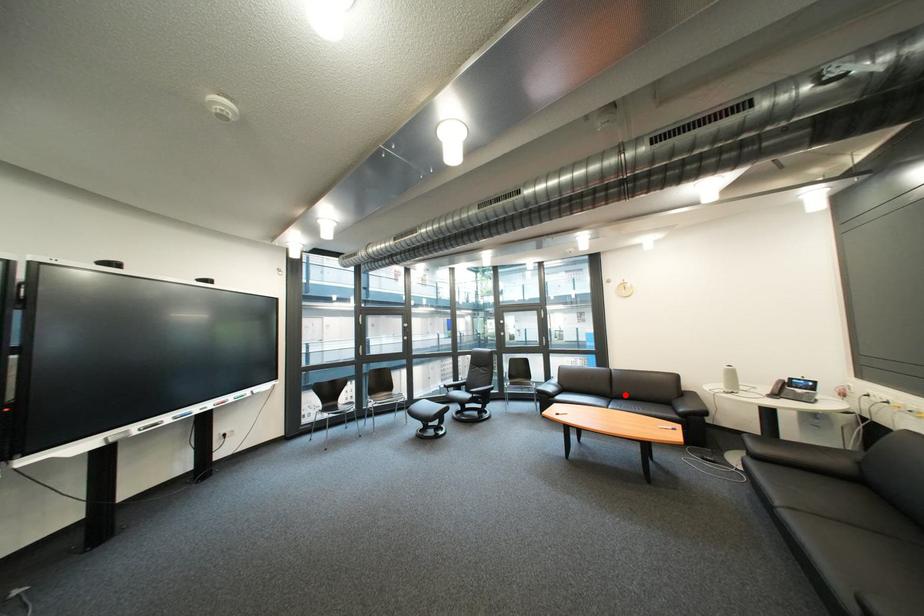
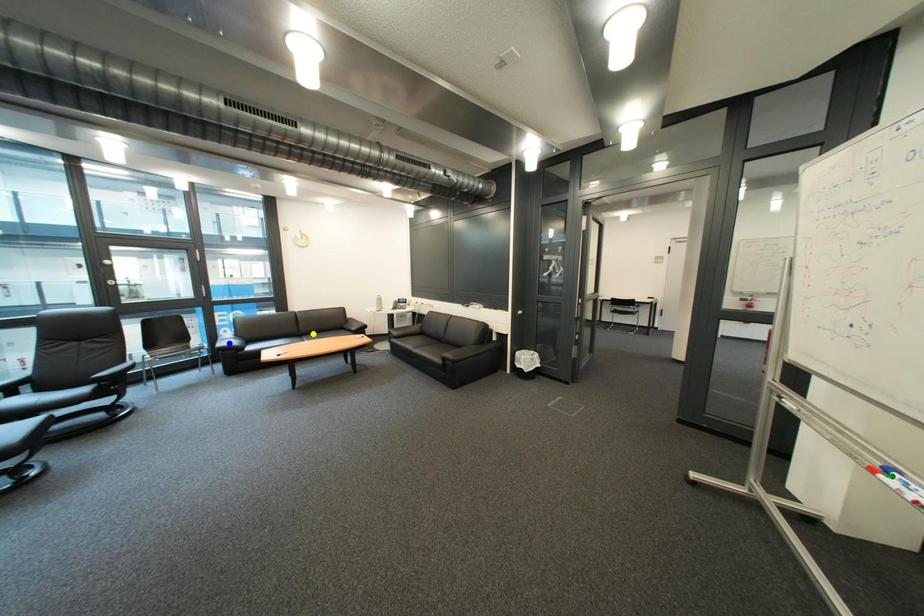
Question: I am providing you with two images of the same scene from different viewpoints. A red point is marked on the first image. You are given multiple points on the second image. Which point in image 2 is actually the same real-world point as the red point in image 1?

Choices:
 (A) yellow point
 (B) green point
 (C) blue point

Answer: (A)